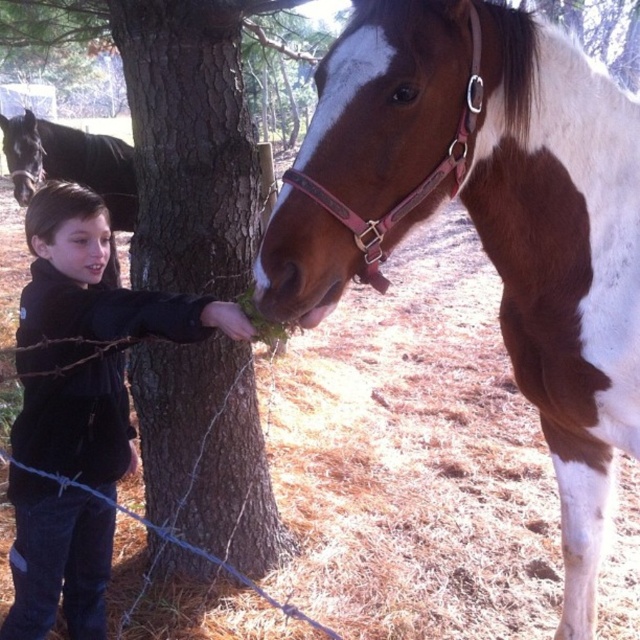
Question: Is black fleece jacket at left wider than shiny black horse at left?

Choices:
 (A) yes
 (B) no

Answer: (B)

Question: Which of the following is the closest to the observer?

Choices:
 (A) (115, 198)
 (B) (45, 492)
 (C) (412, 72)

Answer: (C)

Question: Which object is farther from the camera taking this photo?

Choices:
 (A) black fleece jacket at left
 (B) shiny black horse at left
 (C) brown and white speckled horse at center
 (D) brown rough bark tree at center

Answer: (B)

Question: Can you confirm if brown rough bark tree at center is positioned below black fleece jacket at left?

Choices:
 (A) yes
 (B) no

Answer: (B)

Question: Can you confirm if brown and white speckled horse at center is positioned above black fleece jacket at left?

Choices:
 (A) yes
 (B) no

Answer: (A)

Question: Which point is closer to the camera?

Choices:
 (A) (598, 240)
 (B) (92, 163)
 (C) (147, 273)
 (D) (49, 492)

Answer: (A)